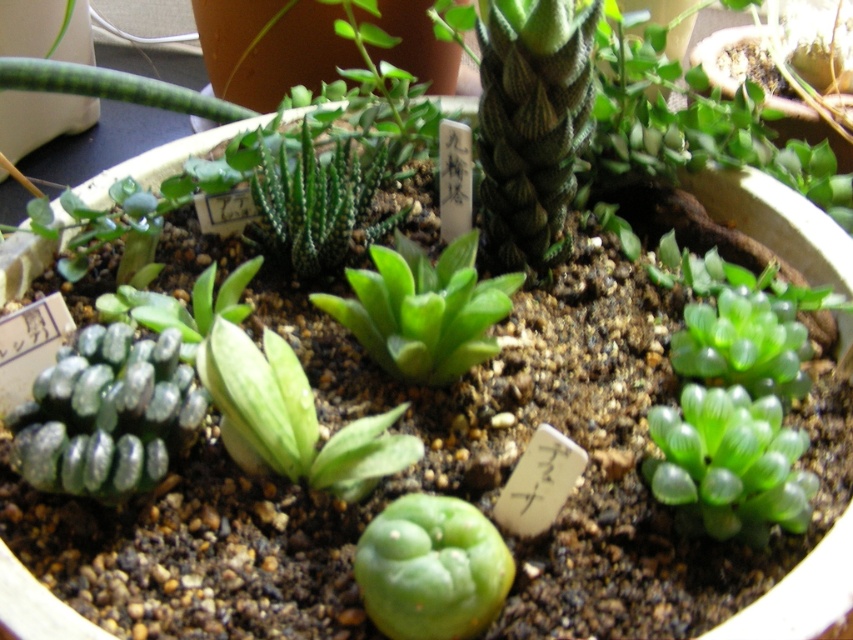
Can you confirm if green matte succulent at center is taller than green textured hexagonal cactus at center?

In fact, green matte succulent at center may be shorter than green textured hexagonal cactus at center.

Which is above, green matte succulent at center or green textured hexagonal cactus at center?

green textured hexagonal cactus at center

Is point (317, 480) more distant than point (305, 164)?

No.

You are a GUI agent. You are given a task and a screenshot of the screen. Output one action in this format:
    pyautogui.click(x=<x>, y=<y>)
    Task: Click on the green matte succulent at center
    The image size is (853, 640).
    Given the screenshot: What is the action you would take?
    pyautogui.click(x=293, y=417)

Does green matte succulent at center appear over green translucent succulent at center?

Actually, green matte succulent at center is below green translucent succulent at center.

At what (x,y) coordinates should I click in order to perform the action: click on green matte succulent at center. Please return your answer as a coordinate pair (x, y). Looking at the image, I should click on (293, 417).

This screenshot has width=853, height=640. I want to click on green matte succulent at center, so click(x=293, y=417).

Who is taller, green textured stone at center or green translucent succulent at center?

green translucent succulent at center is taller.

Does green textured stone at center appear over green translucent succulent at center?

Incorrect, green textured stone at center is not positioned above green translucent succulent at center.

Which is behind, point (131, 392) or point (465, 237)?

Point (465, 237)

At what (x,y) coordinates should I click in order to perform the action: click on green textured stone at center. Please return your answer as a coordinate pair (x, y). The height and width of the screenshot is (640, 853). Looking at the image, I should click on (107, 413).